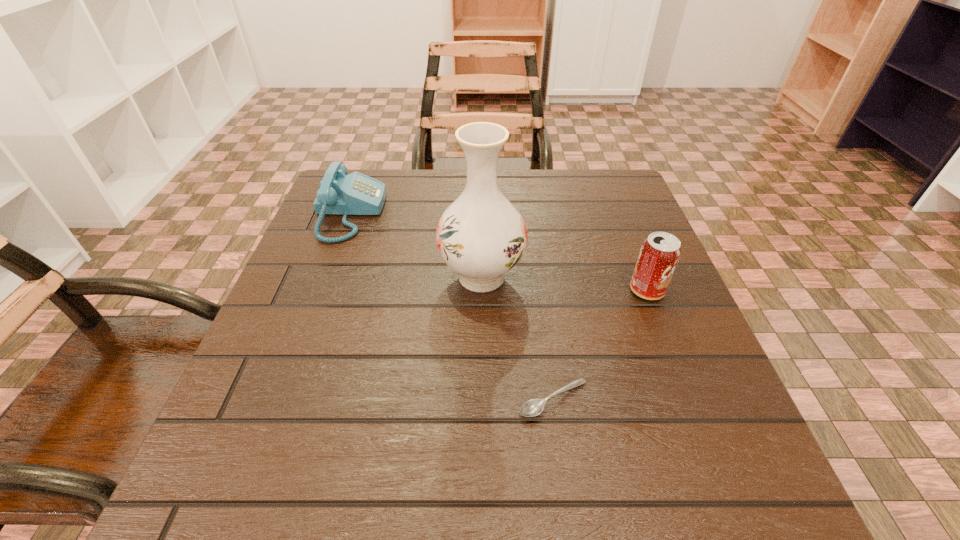
The height and width of the screenshot is (540, 960). I want to click on free space that satisfies the following two spatial constraints: 1. on the dial of the rightmost object; 2. on the right side of the leftmost object, so click(321, 291).

Locate an element on the screen. free region that satisfies the following two spatial constraints: 1. on the dial of the second shortest object; 2. on the back side of the tallest object is located at coordinates click(325, 276).

Locate an element on the screen. This screenshot has height=540, width=960. free spot that satisfies the following two spatial constraints: 1. on the dial of the soda can; 2. on the left side of the farthest object is located at coordinates (321, 291).

Where is `free point that satisfies the following two spatial constraints: 1. on the back side of the soupspoon; 2. on the dial of the telephone`? This screenshot has width=960, height=540. free point that satisfies the following two spatial constraints: 1. on the back side of the soupspoon; 2. on the dial of the telephone is located at coordinates (528, 214).

Find the location of a particular element. The height and width of the screenshot is (540, 960). free location that satisfies the following two spatial constraints: 1. on the back side of the tallest object; 2. on the dial of the leftmost object is located at coordinates (481, 214).

You are a GUI agent. You are given a task and a screenshot of the screen. Output one action in this format:
    pyautogui.click(x=<x>, y=<y>)
    Task: Click on the vacant position in the image that satisfies the following two spatial constraints: 1. on the dial of the vase; 2. on the left side of the leftmost object
    
    Given the screenshot: What is the action you would take?
    pyautogui.click(x=325, y=276)

At what (x,y) coordinates should I click in order to perform the action: click on vacant position in the image that satisfies the following two spatial constraints: 1. on the dial of the third tallest object; 2. on the right side of the nearest object. Please return your answer as a coordinate pair (x, y). The height and width of the screenshot is (540, 960). Looking at the image, I should click on (279, 399).

At what (x,y) coordinates should I click in order to perform the action: click on free location that satisfies the following two spatial constraints: 1. on the back side of the shortest object; 2. on the dial of the leftmost object. Please return your answer as a coordinate pair (x, y). This screenshot has height=540, width=960. Looking at the image, I should click on (528, 214).